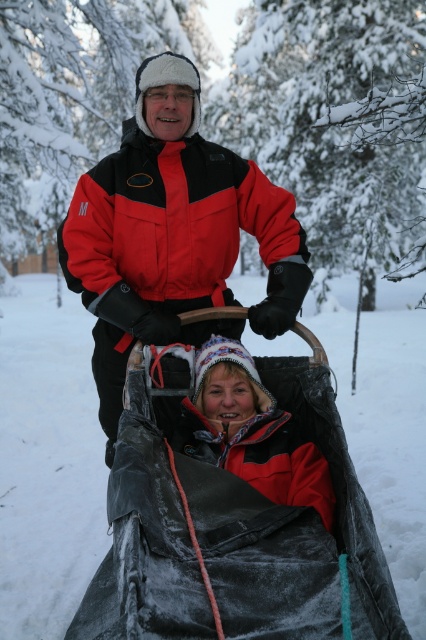
Who is lower down, velvet black blanket at lower center or matte red jacket at center?

velvet black blanket at lower center is lower down.

Between velvet black blanket at lower center and matte red jacket at center, which one appears on the left side from the viewer's perspective?

From the viewer's perspective, velvet black blanket at lower center appears more on the left side.

Who is more distant from viewer, (344, 545) or (259, 406)?

The point (259, 406) is behind.

In order to click on velvet black blanket at lower center in this screenshot , I will do `click(233, 529)`.

Looking at this image, who is positioned more to the left, red/black jacket at center or matte red jacket at center?

Positioned to the left is red/black jacket at center.

Can you confirm if red/black jacket at center is taller than matte red jacket at center?

Yes, red/black jacket at center is taller than matte red jacket at center.

This screenshot has width=426, height=640. What do you see at coordinates (172, 232) in the screenshot? I see `red/black jacket at center` at bounding box center [172, 232].

Where is `red/black jacket at center`? This screenshot has height=640, width=426. red/black jacket at center is located at coordinates (172, 232).

Which is below, velvet black blanket at lower center or red/black jacket at center?

velvet black blanket at lower center is below.

Who is shorter, velvet black blanket at lower center or red/black jacket at center?

velvet black blanket at lower center is shorter.

Image resolution: width=426 pixels, height=640 pixels. In order to click on velvet black blanket at lower center in this screenshot , I will do `click(233, 529)`.